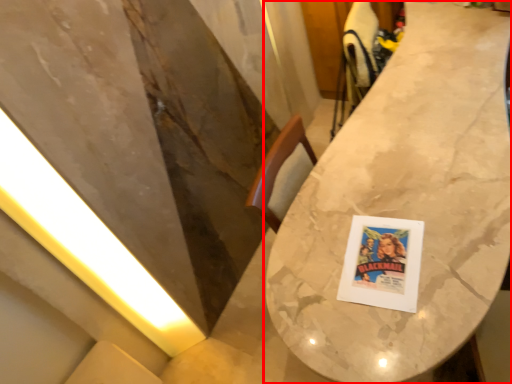
Question: From the image's perspective, where is table (annotated by the red box) located relative to light?

Choices:
 (A) below
 (B) above

Answer: (B)